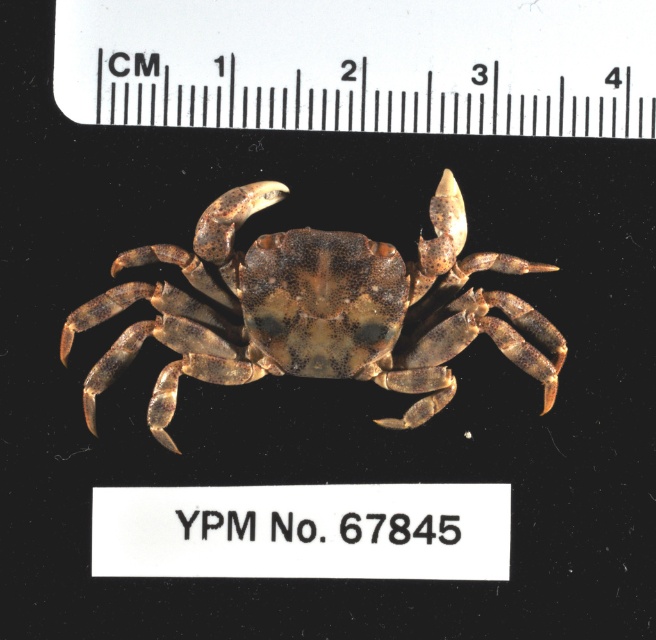
You are a biologist examining the image of the brown textured crab at center. You need to measure its length using the white plastic ruler at upper center. However, you notice that the ruler is not directly above the crab. Can you still accurately measure the crab using the ruler?

The white plastic ruler at upper center is to the right of brown textured crab at center, so the ruler is not aligned with the crab. This misalignment may introduce inaccuracies in measuring the crab since the ruler is not positioned directly over or adjacent to it. For precise measurements, the ruler should be placed in line with the crab.

Based on the photo, you are an observer looking at the image. You notice the white plastic ruler at upper center and the brown textured crab at center. Which object is closer to you?

The white plastic ruler at upper center is closer to you because it is in front of the brown textured crab at center.